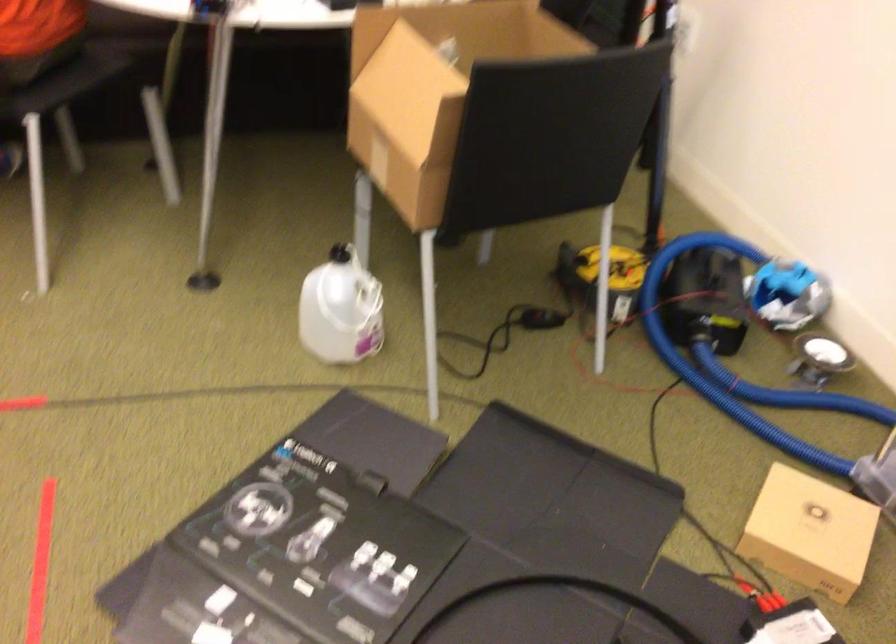
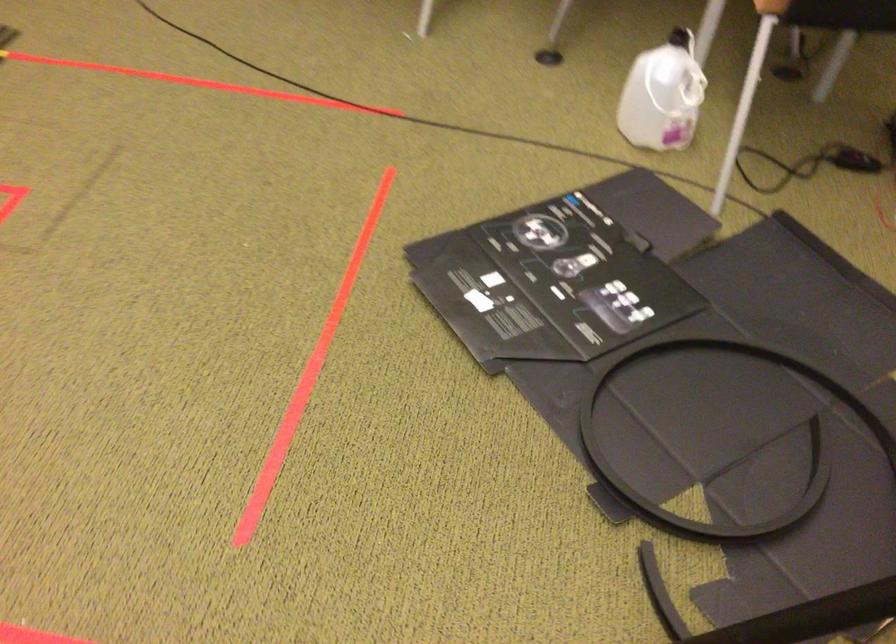
Question: How did the camera likely rotate?

Choices:
 (A) Left
 (B) Right
 (C) Up
 (D) Down

Answer: (A)